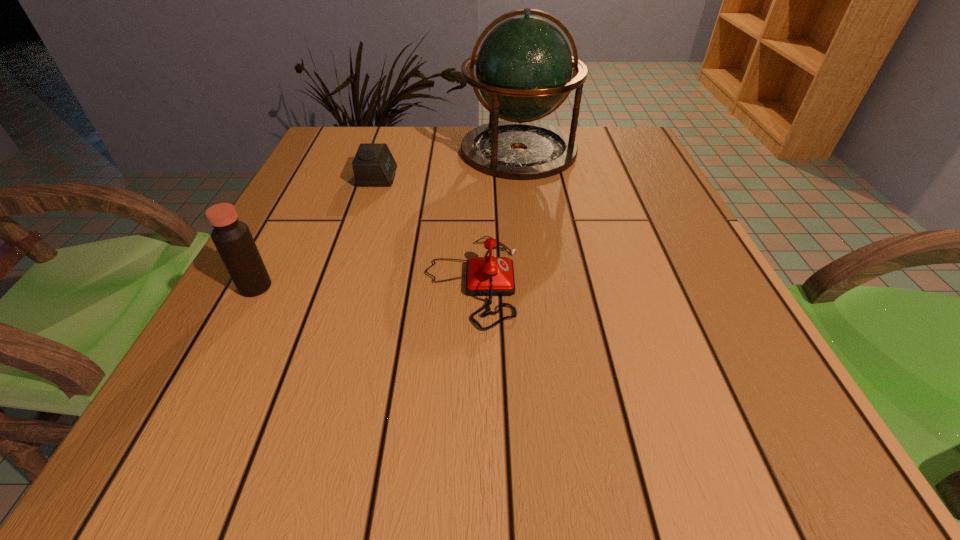
The height and width of the screenshot is (540, 960). I want to click on blank region between the globe and the telephone, so click(495, 216).

Find the location of `unoccupied area between the leftmost object and the tallest object`. unoccupied area between the leftmost object and the tallest object is located at coordinates (387, 219).

Identify the location of vacant space that is in between the telephone and the tallest object. Image resolution: width=960 pixels, height=540 pixels. (495, 216).

Identify the location of vacant space that's between the telephone and the second tallest object. (364, 284).

Locate an element on the screen. The image size is (960, 540). vacant area that lies between the telephone and the globe is located at coordinates (495, 216).

You are a GUI agent. You are given a task and a screenshot of the screen. Output one action in this format:
    pyautogui.click(x=<x>, y=<y>)
    Task: Click on the vacant area that lies between the telephone and the leftmost object
    
    Given the screenshot: What is the action you would take?
    pyautogui.click(x=364, y=284)

Image resolution: width=960 pixels, height=540 pixels. I want to click on vacant space in between the leftmost object and the alarm clock, so click(x=317, y=232).

Locate an element on the screen. The height and width of the screenshot is (540, 960). free space between the second object from left to right and the telephone is located at coordinates (425, 229).

Locate which object ranks in proximity to the telephone. Please provide its 2D coordinates. Your answer should be formatted as a tuple, i.e. [(x, y)], where the tuple contains the x and y coordinates of a point satisfying the conditions above.

[(373, 165)]

Select which object is the second closest to the second object from left to right. Please provide its 2D coordinates. Your answer should be formatted as a tuple, i.e. [(x, y)], where the tuple contains the x and y coordinates of a point satisfying the conditions above.

[(490, 276)]